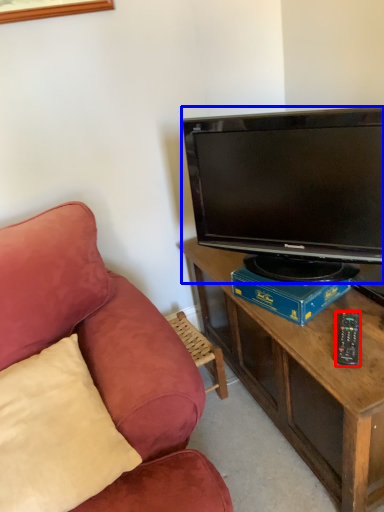
Question: Which point is further to the camera, remote control (highlighted by a red box) or television (highlighted by a blue box)?

Choices:
 (A) remote control
 (B) television

Answer: (A)